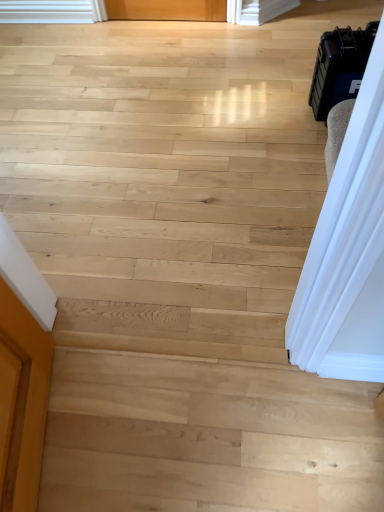
I want to click on natural wood stairwell at lower left, so click(x=206, y=436).

Measure the distance between point (x=198, y=489) and camera.

The distance of point (x=198, y=489) from camera is 3.59 feet.

This screenshot has height=512, width=384. What do you see at coordinates (206, 436) in the screenshot?
I see `natural wood stairwell at lower left` at bounding box center [206, 436].

Identify the location of natural wood stairwell at lower left. (206, 436).